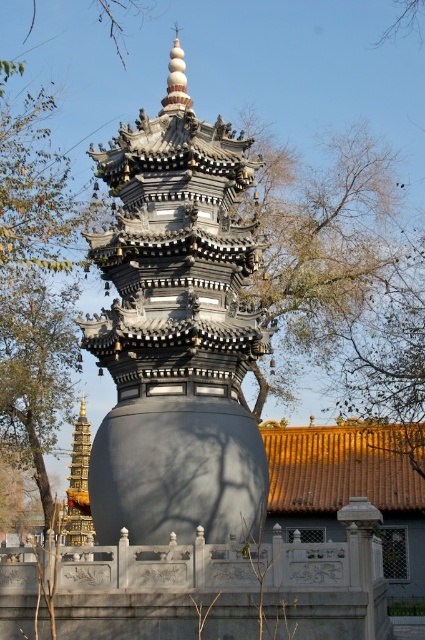
You are standing in front of the pagoda and want to take a photo that includes both the matte black pagoda at center and the green leafy tree at left. Which object should you position closer to the front of the frame to ensure both are in focus?

Since the matte black pagoda at center is closer to the viewer than the green leafy tree at left, you should position the matte black pagoda at center closer to the front of the frame to ensure both are in focus.